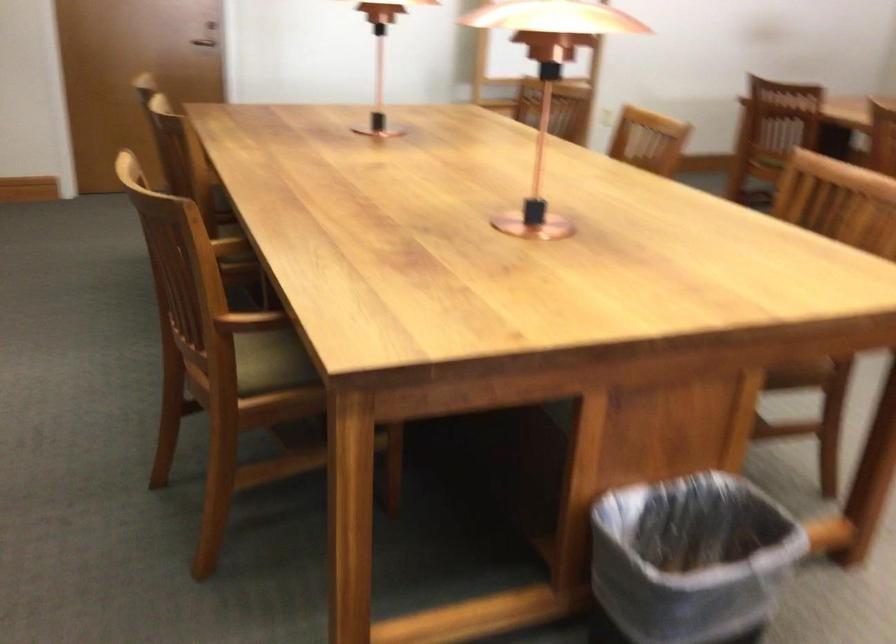
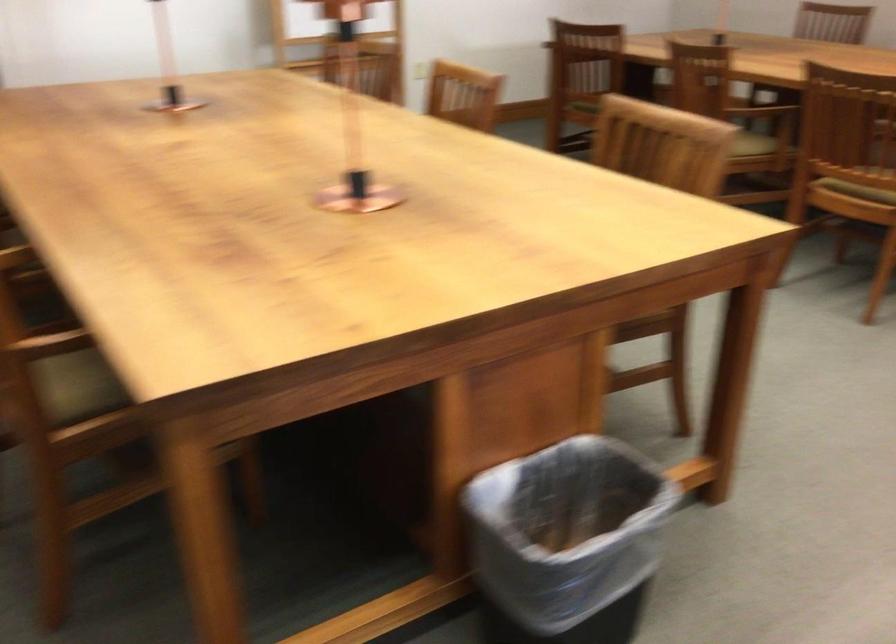
Question: The images are taken continuously from a first-person perspective. In which direction is your viewpoint rotating?

Choices:
 (A) Left
 (B) Right
 (C) Up
 (D) Down

Answer: (B)